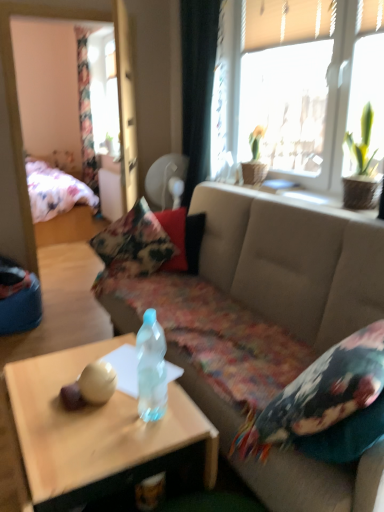
Where is `blank space situated above translucent plastic coffee table at center (from a real-world perspective)`? blank space situated above translucent plastic coffee table at center (from a real-world perspective) is located at coordinates (88, 404).